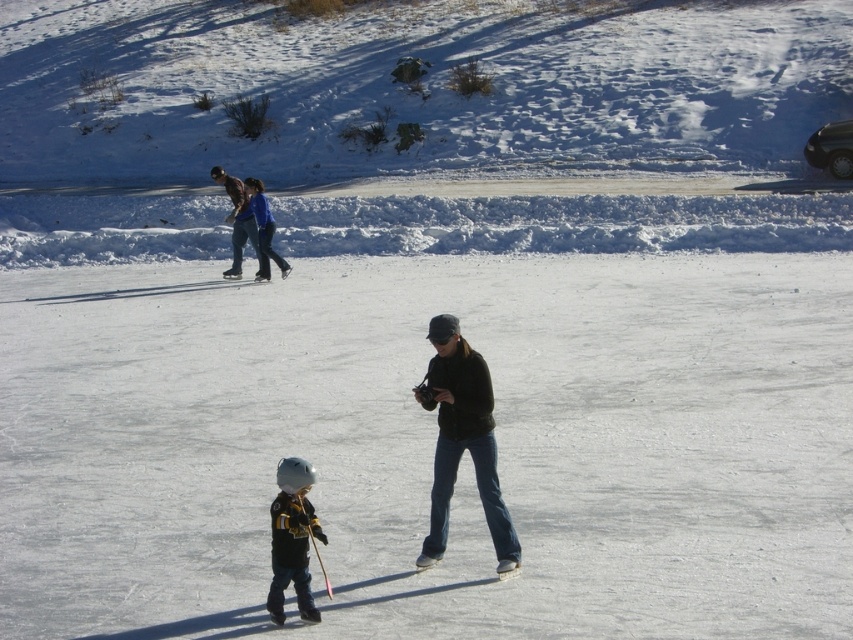
Question: Based on their relative distances, which object is nearer to the matte black helmet at center?

Choices:
 (A) black matte jacket at center
 (B) white plastic ski at center

Answer: (A)

Question: Among these points, which one is farthest from the camera?

Choices:
 (A) (277, 529)
 (B) (502, 563)
 (C) (437, 442)

Answer: (C)

Question: Which point is closer to the camera?

Choices:
 (A) matte black helmet at center
 (B) white plastic ski at center
 (C) black matte jacket at center

Answer: (A)

Question: Does black matte jacket at center have a lesser width compared to white plastic ski at center?

Choices:
 (A) yes
 (B) no

Answer: (B)

Question: Can you confirm if matte black helmet at center is positioned above white plastic ski at center?

Choices:
 (A) yes
 (B) no

Answer: (A)

Question: Can you confirm if matte black helmet at center is bigger than white plastic ski at center?

Choices:
 (A) no
 (B) yes

Answer: (B)